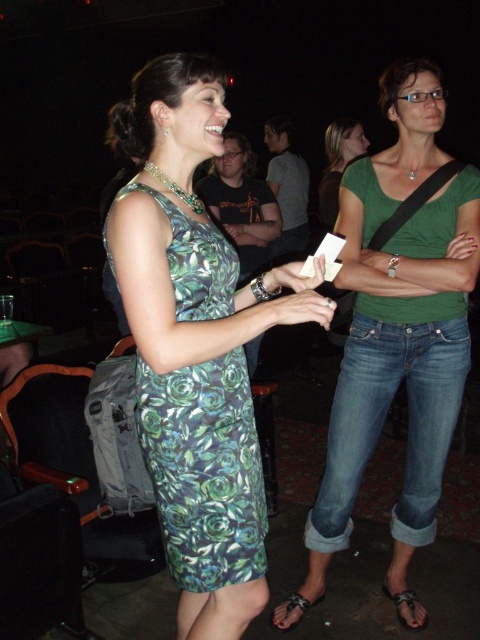
You are at the theater and want to move from the point at coordinate (375, 179) to the point at coordinate (139, 436). Is the destination point in front of or behind you?

The point at coordinate (139, 436) is in front of the point at coordinate (375, 179), so the destination point is in front of you.